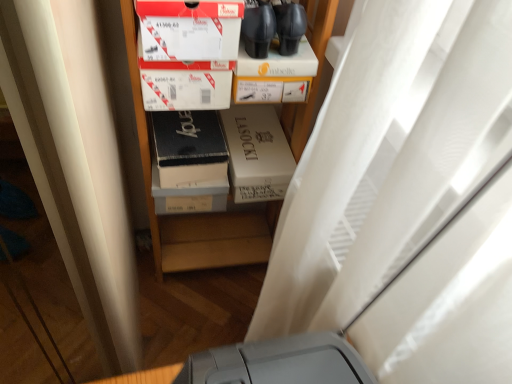
Question: Should I look upward or downward to see white matte shower curtain at upper center?

Choices:
 (A) up
 (B) down

Answer: (B)